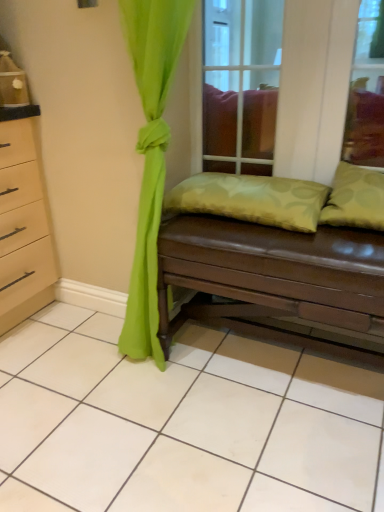
Question: Is green fabric pillow at right, acting as the 2th pillow starting from the left, bigger than green textured pillow at center, the 2th pillow viewed from the right?

Choices:
 (A) yes
 (B) no

Answer: (B)

Question: Can you confirm if green fabric pillow at right, arranged as the first pillow when viewed from the right, is thinner than green textured pillow at center, the 2th pillow viewed from the right?

Choices:
 (A) yes
 (B) no

Answer: (B)

Question: From a real-world perspective, is green fabric pillow at right, arranged as the first pillow when viewed from the right, on green textured pillow at center, placed as the 1th pillow when sorted from left to right?

Choices:
 (A) no
 (B) yes

Answer: (B)

Question: Is green fabric pillow at right, arranged as the first pillow when viewed from the right, to the left of green textured pillow at center, placed as the 1th pillow when sorted from left to right, from the viewer's perspective?

Choices:
 (A) yes
 (B) no

Answer: (B)

Question: Does green fabric pillow at right, acting as the 2th pillow starting from the left, have a greater width compared to green textured pillow at center, placed as the 1th pillow when sorted from left to right?

Choices:
 (A) no
 (B) yes

Answer: (B)

Question: Can you confirm if green fabric pillow at right, arranged as the first pillow when viewed from the right, is shorter than green textured pillow at center, placed as the 1th pillow when sorted from left to right?

Choices:
 (A) yes
 (B) no

Answer: (B)

Question: Considering the relative sizes of brown leather studio couch at center and green fabric pillow at right, acting as the 2th pillow starting from the left, in the image provided, is brown leather studio couch at center wider than green fabric pillow at right, acting as the 2th pillow starting from the left,?

Choices:
 (A) no
 (B) yes

Answer: (B)

Question: From a real-world perspective, is brown leather studio couch at center located higher than green fabric pillow at right, arranged as the first pillow when viewed from the right?

Choices:
 (A) yes
 (B) no

Answer: (B)

Question: Is brown leather studio couch at center further to camera compared to green fabric pillow at right, acting as the 2th pillow starting from the left?

Choices:
 (A) yes
 (B) no

Answer: (B)

Question: Can you confirm if brown leather studio couch at center is smaller than green fabric pillow at right, acting as the 2th pillow starting from the left?

Choices:
 (A) no
 (B) yes

Answer: (A)

Question: Is brown leather studio couch at center oriented towards green fabric pillow at right, acting as the 2th pillow starting from the left?

Choices:
 (A) no
 (B) yes

Answer: (A)

Question: Is brown leather studio couch at center looking in the opposite direction of green fabric pillow at right, arranged as the first pillow when viewed from the right?

Choices:
 (A) yes
 (B) no

Answer: (B)

Question: From the image's perspective, is transparent glass door at center below brown leather studio couch at center?

Choices:
 (A) yes
 (B) no

Answer: (B)